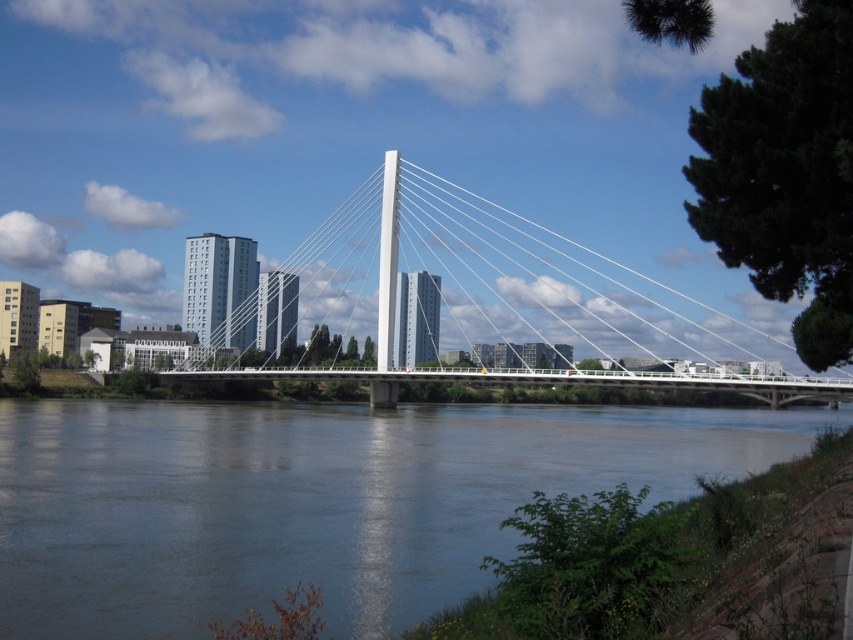
Question: Among these objects, which one is nearest to the camera?

Choices:
 (A) white metallic suspension bridge at center
 (B) dark blue water at lower center

Answer: (B)

Question: Among these objects, which one is farthest from the camera?

Choices:
 (A) dark blue water at lower center
 (B) white metallic suspension bridge at center

Answer: (B)

Question: Does dark blue water at lower center lie in front of white metallic suspension bridge at center?

Choices:
 (A) yes
 (B) no

Answer: (A)

Question: Does dark blue water at lower center have a lesser width compared to white metallic suspension bridge at center?

Choices:
 (A) yes
 (B) no

Answer: (A)

Question: Can you confirm if dark blue water at lower center is smaller than white metallic suspension bridge at center?

Choices:
 (A) yes
 (B) no

Answer: (A)